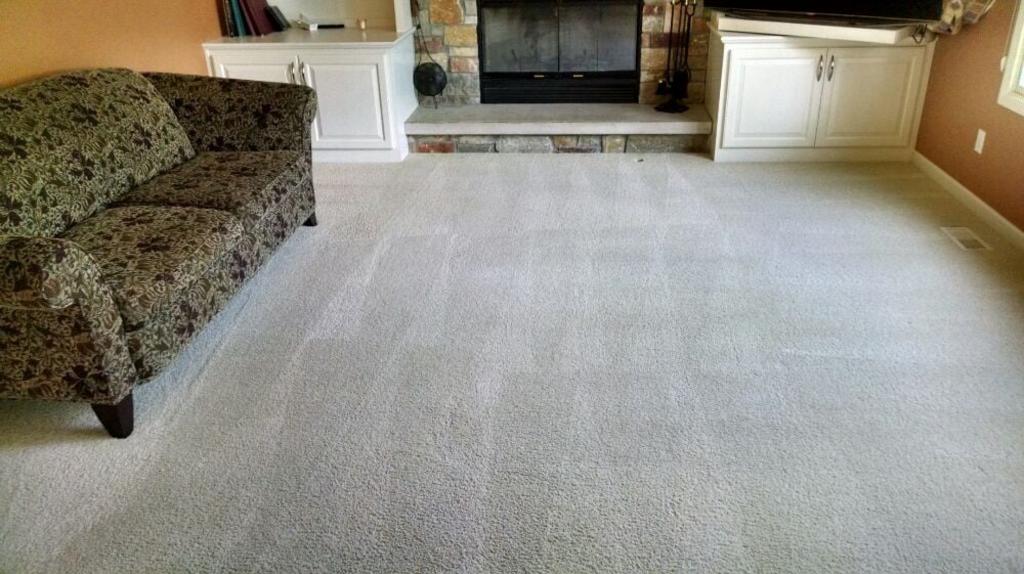
Locate an element on the screen. Image resolution: width=1024 pixels, height=574 pixels. floor is located at coordinates (485, 434).